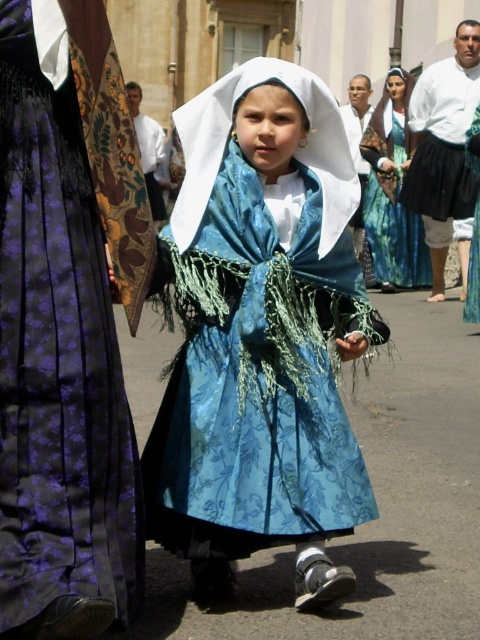
Is matte purple skirt at left taller than white cotton shirt at upper right?

Incorrect, matte purple skirt at left's height is not larger of white cotton shirt at upper right's.

Is point (24, 80) farther from camera compared to point (464, 189)?

No.

Which is in front, point (79, 492) or point (444, 140)?

Point (79, 492) is in front.

Image resolution: width=480 pixels, height=640 pixels. What are the coordinates of `matte purple skirt at left` in the screenshot? It's located at coord(67,324).

The width and height of the screenshot is (480, 640). What do you see at coordinates (442, 150) in the screenshot?
I see `white cotton shirt at upper right` at bounding box center [442, 150].

Between white cotton shirt at upper right and blue textured fabric dress at center, which one appears on the left side from the viewer's perspective?

blue textured fabric dress at center

Locate an element on the screen. The height and width of the screenshot is (640, 480). white cotton shirt at upper right is located at coordinates (442, 150).

Is blue fabric dress at center to the right of matte purple skirt at left from the viewer's perspective?

Indeed, blue fabric dress at center is positioned on the right side of matte purple skirt at left.

What do you see at coordinates (261, 336) in the screenshot? I see `blue fabric dress at center` at bounding box center [261, 336].

Which is behind, point (291, 83) or point (48, 13)?

The point (291, 83) is behind.

You are a GUI agent. You are given a task and a screenshot of the screen. Output one action in this format:
    pyautogui.click(x=<x>, y=<y>)
    Task: Click on the blue fabric dress at center
    Image resolution: width=480 pixels, height=640 pixels.
    Given the screenshot: What is the action you would take?
    pyautogui.click(x=261, y=336)